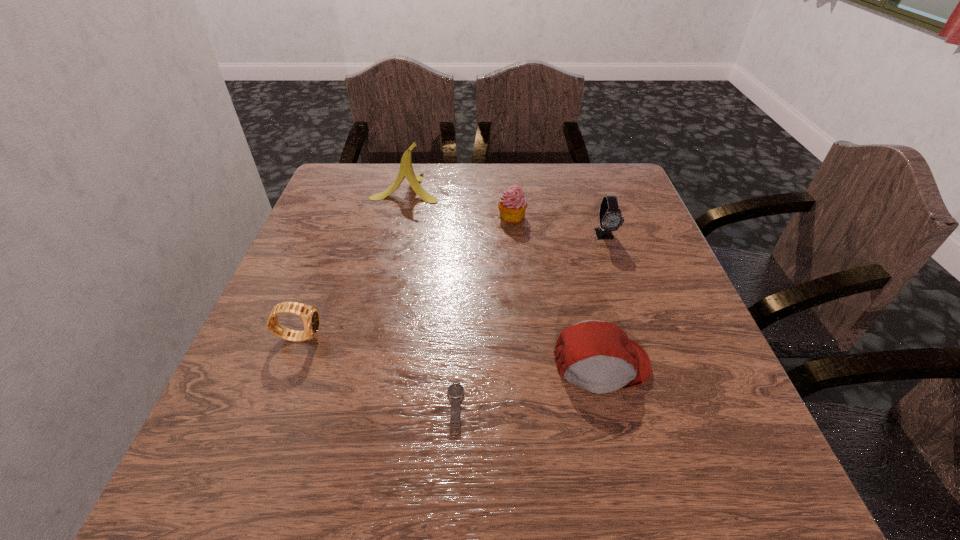
Locate an element on the screen. The height and width of the screenshot is (540, 960). the farthest object is located at coordinates (406, 170).

In order to click on the tallest object in this screenshot , I will do (406, 170).

I want to click on the farthest watch, so click(x=610, y=217).

Identify the location of the tallest watch. This screenshot has height=540, width=960. 610,217.

Find the location of `cupcake`. cupcake is located at coordinates (512, 206).

Find the location of a particular element. This screenshot has height=540, width=960. the second nearest watch is located at coordinates (310, 316).

The height and width of the screenshot is (540, 960). Find the location of `the second shortest watch`. the second shortest watch is located at coordinates (310, 316).

Find the location of `cap`. cap is located at coordinates pos(598,356).

This screenshot has height=540, width=960. I want to click on the fourth object from right to left, so click(x=455, y=391).

At what (x,y) coordinates should I click in order to perform the action: click on the shortest object. Please return your answer as a coordinate pair (x, y). Image resolution: width=960 pixels, height=540 pixels. Looking at the image, I should click on (455, 391).